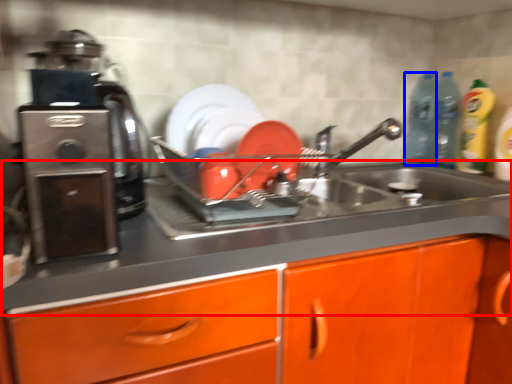
Question: Which object is closer to the camera taking this photo, counter top (highlighted by a red box) or bottle (highlighted by a blue box)?

Choices:
 (A) counter top
 (B) bottle

Answer: (A)